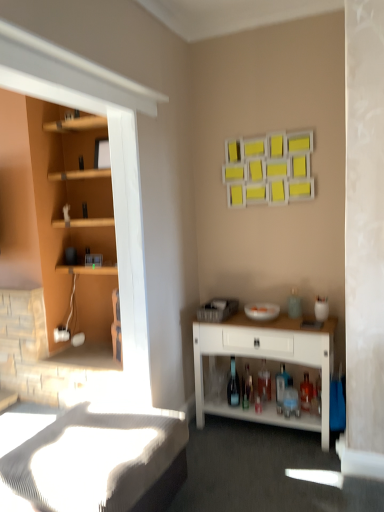
Question: Is transparent glass bottle at center, the 4th bottle positioned from the right, positioned far away from translucent glass bottle at lower center, which appears as the 3th bottle when viewed from the front?

Choices:
 (A) yes
 (B) no

Answer: (B)

Question: Is transparent glass bottle at center, the 1th bottle positioned from the left, shorter than translucent glass bottle at lower center, the 2th bottle positioned from the right?

Choices:
 (A) no
 (B) yes

Answer: (A)

Question: Can you confirm if transparent glass bottle at center, the 4th bottle positioned from the right, is smaller than translucent glass bottle at lower center, which is the 3th bottle in left-to-right order?

Choices:
 (A) yes
 (B) no

Answer: (B)

Question: Is transparent glass bottle at center, the 1th bottle positioned from the left, outside translucent glass bottle at lower center, which is the second bottle from back to front?

Choices:
 (A) no
 (B) yes

Answer: (B)

Question: Does transparent glass bottle at center, the 1th bottle positioned from the left, lie behind translucent glass bottle at lower center, which appears as the 3th bottle when viewed from the front?

Choices:
 (A) yes
 (B) no

Answer: (B)

Question: Is transparent glass bottle at center, placed as the third bottle when sorted from back to front, with translucent glass bottle at lower center, which appears as the 3th bottle when viewed from the front?

Choices:
 (A) yes
 (B) no

Answer: (B)

Question: Is translucent glass bottle at lower center, placed as the 3th bottle when sorted from right to left, located within translucent glass bottle at lower center, marked as the fourth bottle in a back-to-front arrangement?

Choices:
 (A) no
 (B) yes

Answer: (A)

Question: Is the position of translucent glass bottle at lower center, the 4th bottle when ordered from left to right, less distant than that of translucent glass bottle at lower center, the second bottle positioned from the left?

Choices:
 (A) yes
 (B) no

Answer: (A)

Question: From a real-world perspective, does translucent glass bottle at lower center, marked as the fourth bottle in a back-to-front arrangement, sit lower than translucent glass bottle at lower center, which is the 4th bottle in front-to-back order?

Choices:
 (A) yes
 (B) no

Answer: (B)

Question: Can you confirm if translucent glass bottle at lower center, the 4th bottle when ordered from left to right, is bigger than translucent glass bottle at lower center, arranged as the 1th bottle when viewed from the back?

Choices:
 (A) no
 (B) yes

Answer: (B)

Question: Is the position of translucent glass bottle at lower center, which appears as the 1th bottle when viewed from the front, more distant than that of translucent glass bottle at lower center, the second bottle positioned from the left?

Choices:
 (A) no
 (B) yes

Answer: (A)

Question: Is translucent glass bottle at lower center, marked as the fourth bottle in a back-to-front arrangement, not inside translucent glass bottle at lower center, placed as the 3th bottle when sorted from right to left?

Choices:
 (A) no
 (B) yes

Answer: (B)

Question: Considering the relative positions of translucent glass bottle at lower center, the 4th bottle when ordered from left to right, and white textured bed frame at lower left in the image provided, is translucent glass bottle at lower center, the 4th bottle when ordered from left to right, to the left of white textured bed frame at lower left from the viewer's perspective?

Choices:
 (A) no
 (B) yes

Answer: (A)